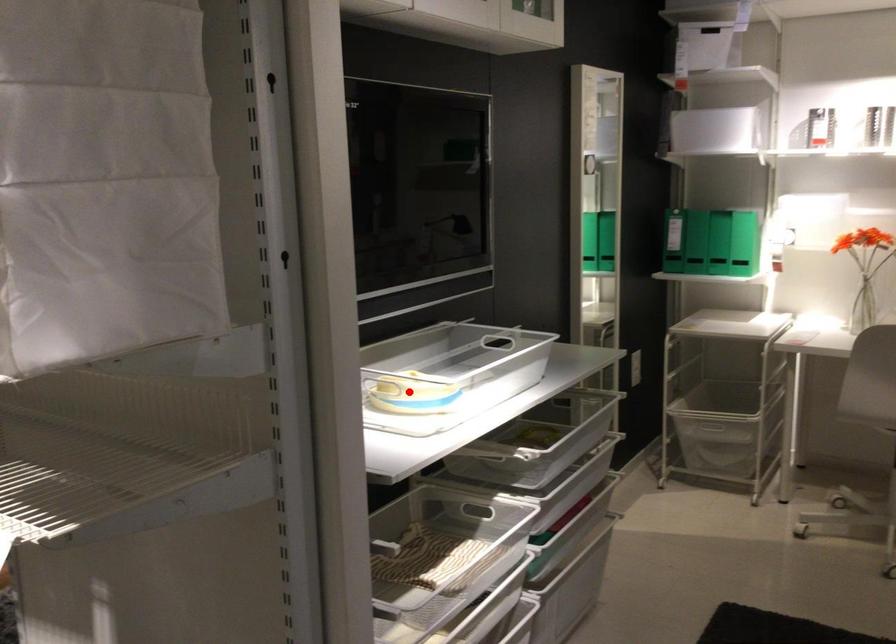
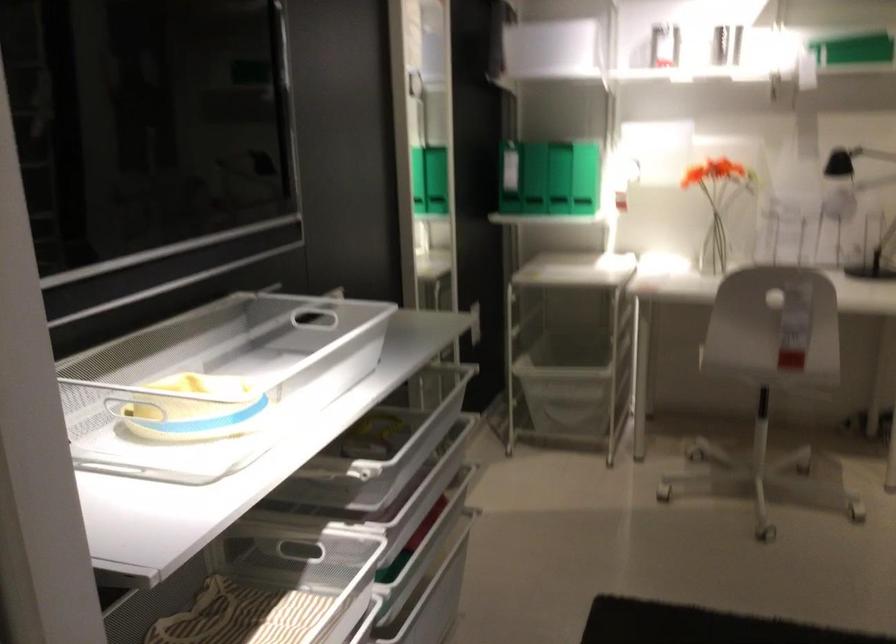
Question: I am providing you with two images of the same scene from different viewpoints. A red point is marked on the first image. At the location where the point appears in image 1, is it still visible in image 2?

Choices:
 (A) Yes
 (B) No

Answer: (B)